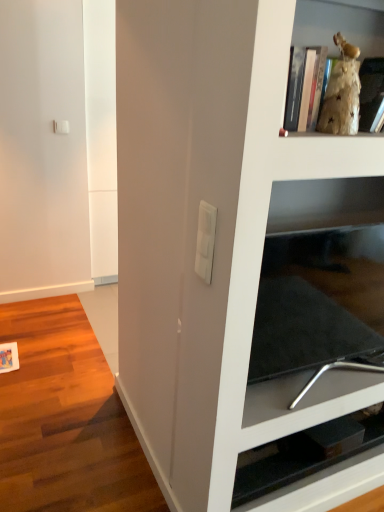
Question: Considering the positions of black glossy tv stand at lower right, the second shelf from the front, and white plastic light switch at center in the image, is black glossy tv stand at lower right, the second shelf from the front, wider or thinner than white plastic light switch at center?

Choices:
 (A) thin
 (B) wide

Answer: (B)

Question: Considering the relative positions of black glossy tv stand at lower right, the second shelf from the front, and white plastic light switch at center in the image provided, is black glossy tv stand at lower right, the second shelf from the front, to the left or to the right of white plastic light switch at center?

Choices:
 (A) right
 (B) left

Answer: (A)

Question: Which object is positioned farthest from the gold textured figurine at upper right, placed as the first shelf when sorted from top to bottom?

Choices:
 (A) black glossy tv stand at lower right, the 2th shelf when ordered from top to bottom
 (B) white plastic light switch at center

Answer: (A)

Question: Based on their relative distances, which object is farther from the black glossy tv stand at lower right, marked as the first shelf in a bottom-to-top arrangement?

Choices:
 (A) gold textured figurine at upper right, placed as the first shelf when sorted from top to bottom
 (B) white plastic light switch at center

Answer: (A)